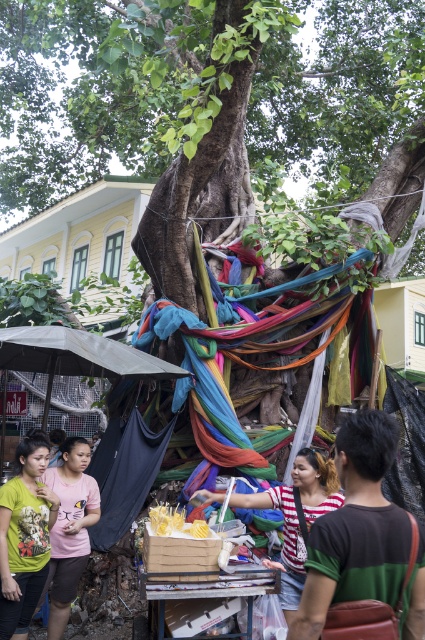
You are at a festival and want to buy some snacks. You see a striped fabric stall at lower right and a gray fabric canopy at lower left. Which one is located to the right side of the other?

The striped fabric stall at lower right is located to the right of the gray fabric canopy at lower left.